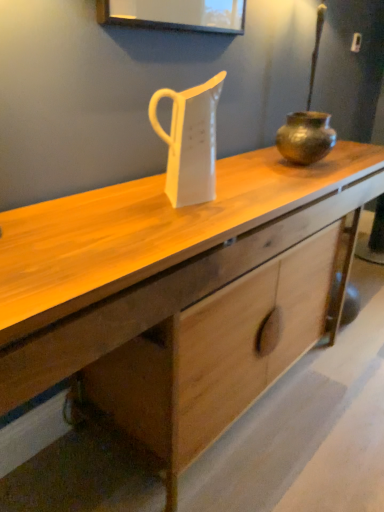
This screenshot has width=384, height=512. Find the location of `free space in front of bronze textured pot at center`. free space in front of bronze textured pot at center is located at coordinates (308, 177).